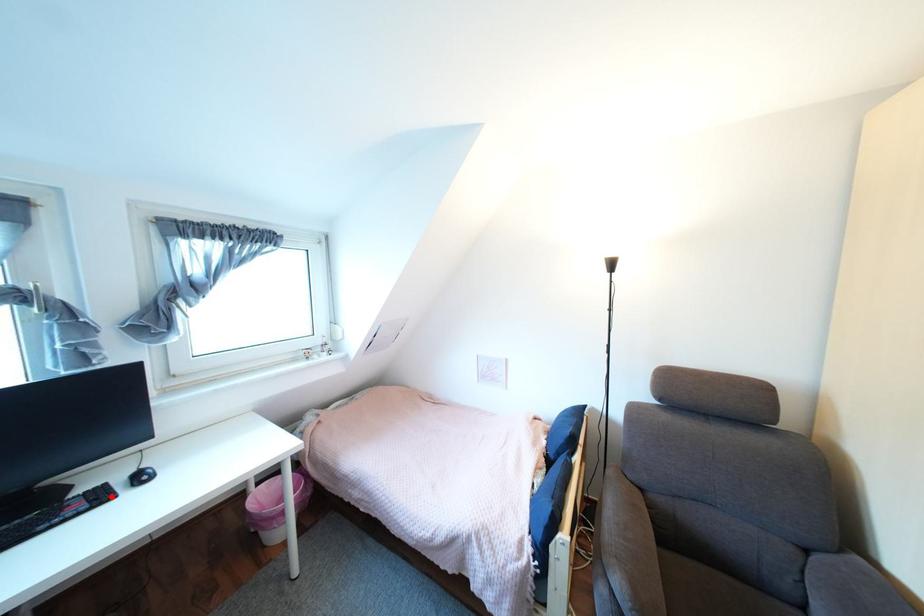
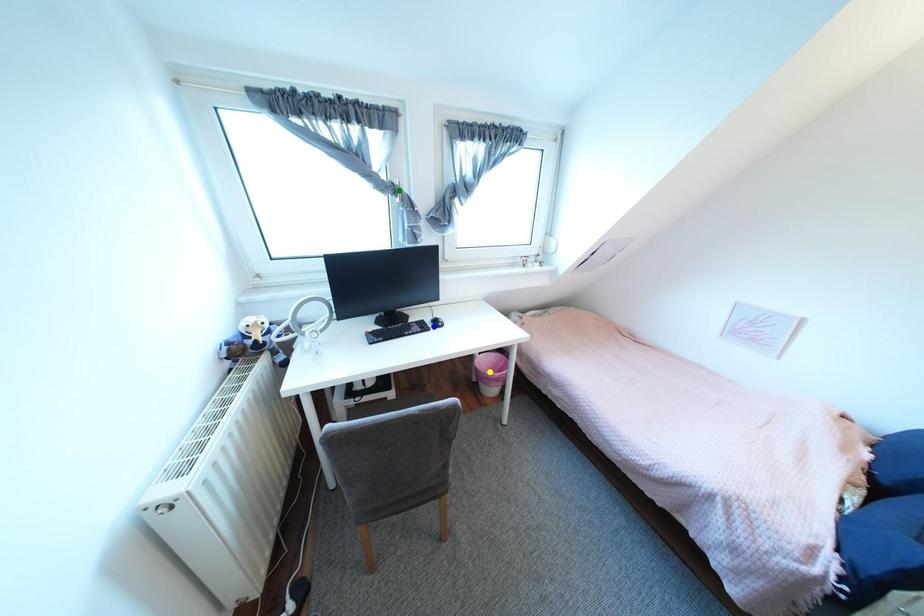
Question: I am providing you with two images of the same scene from different viewpoints. A red point is marked on the first image. You are given multiple points on the second image. Which point in image 2 represents the same 3d spot as the red point in image 1?

Choices:
 (A) yellow point
 (B) green point
 (C) blue point

Answer: (C)